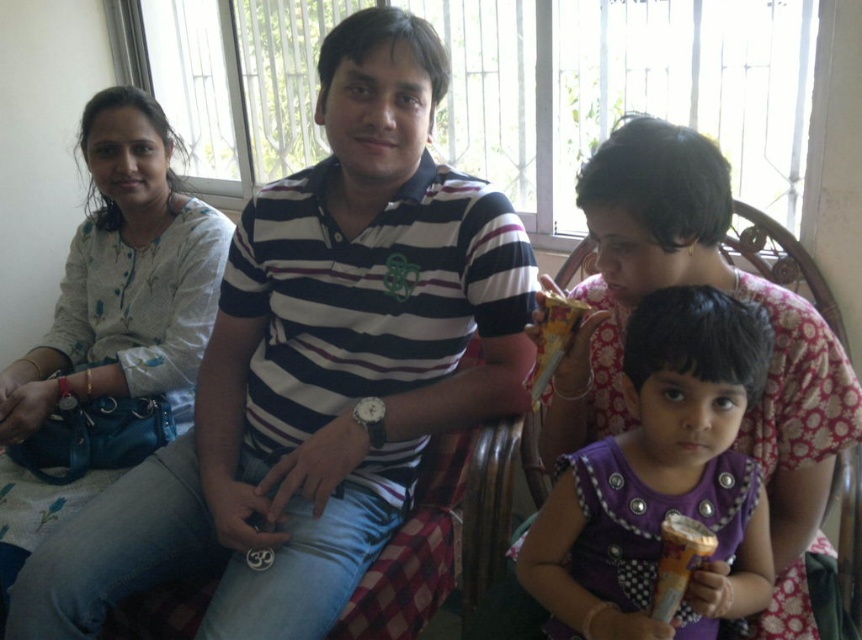
Question: Is white cotton shirt at left above purple satin dress at center?

Choices:
 (A) yes
 (B) no

Answer: (A)

Question: Can you confirm if purple satin dress at center is wider than metallic gold ice cream cone at lower right?

Choices:
 (A) yes
 (B) no

Answer: (A)

Question: Which point appears closest to the camera in this image?

Choices:
 (A) (98, 260)
 (B) (679, 596)
 (C) (747, 378)
 (D) (486, 252)

Answer: (B)

Question: Can you confirm if striped cotton shirt at center is positioned above purple satin dress at center?

Choices:
 (A) no
 (B) yes

Answer: (B)

Question: Which point is closer to the camera taking this photo?

Choices:
 (A) (669, 573)
 (B) (172, 141)
 (C) (665, 451)

Answer: (A)

Question: Which object is farther from the camera taking this photo?

Choices:
 (A) metallic gold ice cream cone at lower right
 (B) striped cotton shirt at center
 (C) purple satin dress at center
 (D) white cotton shirt at left

Answer: (D)